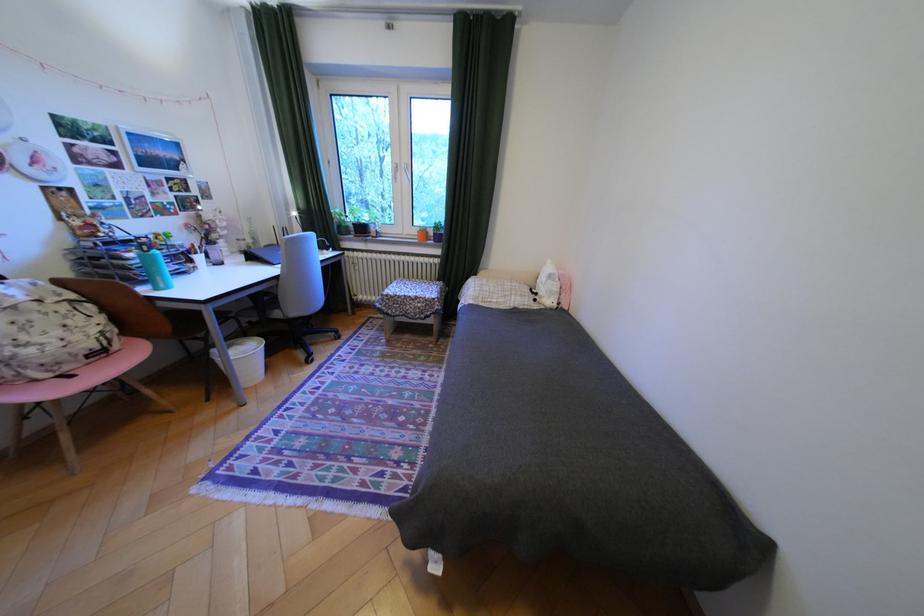
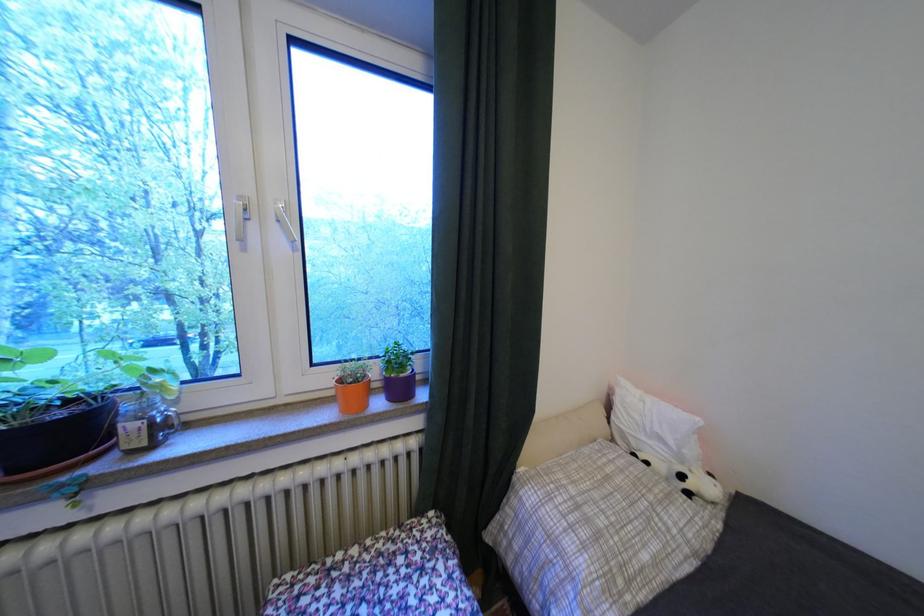
Where in the second image is the point corresponding to the point at 508,302 from the first image?

(667, 562)